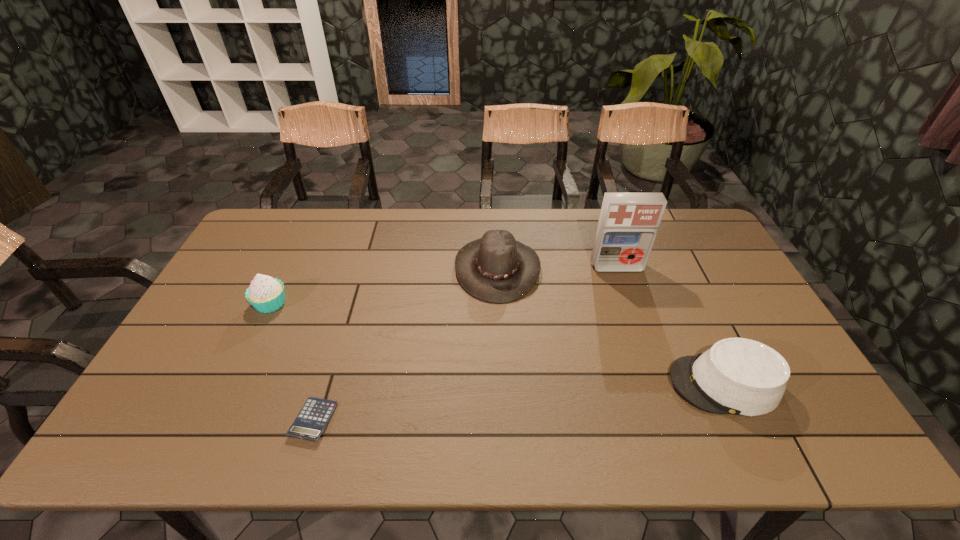
Locate an element on the screen. This screenshot has height=540, width=960. free space located on the front-facing side of the farther hat is located at coordinates (338, 268).

Identify the location of free location located on the front-facing side of the farther hat. This screenshot has height=540, width=960. (430, 268).

Image resolution: width=960 pixels, height=540 pixels. Identify the location of free space located on the front-facing side of the farther hat. (434, 268).

Find the location of `vacant space located 0.260m on the front-facing side of the nearer hat`. vacant space located 0.260m on the front-facing side of the nearer hat is located at coordinates (566, 384).

At what (x,y) coordinates should I click in order to perform the action: click on vacant space located on the front-facing side of the nearer hat. Please return your answer as a coordinate pair (x, y). Looking at the image, I should click on (559, 384).

Where is `vacant space located on the front-facing side of the nearer hat`? The width and height of the screenshot is (960, 540). vacant space located on the front-facing side of the nearer hat is located at coordinates [637, 384].

At what (x,y) coordinates should I click in order to perform the action: click on free space located on the right of the shortest object. Please return your answer as a coordinate pair (x, y). Image resolution: width=960 pixels, height=540 pixels. Looking at the image, I should click on (440, 420).

This screenshot has height=540, width=960. I want to click on object that is at the far edge, so click(496, 268).

Find the location of a particular element. object that is at the near edge is located at coordinates (310, 423).

You are a GUI agent. You are given a task and a screenshot of the screen. Output one action in this format:
    pyautogui.click(x=<x>, y=<y>)
    Task: Click on the object located at the left edge
    Image resolution: width=960 pixels, height=540 pixels.
    Given the screenshot: What is the action you would take?
    pyautogui.click(x=266, y=294)